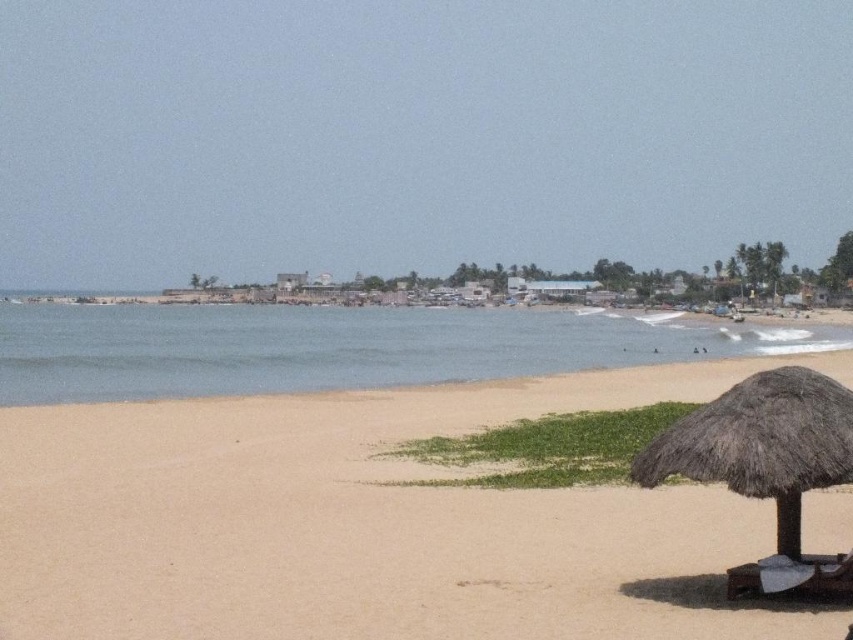
Based on the photo, between light brown sand at lower left and thatched straw umbrella at lower right, which one has less height?

light brown sand at lower left

Between light brown sand at lower left and thatched straw umbrella at lower right, which one is positioned lower?

Positioned lower is light brown sand at lower left.

Between point (90, 564) and point (645, 468), which one is positioned in front?

Point (645, 468) is in front.

Find the location of a particular element. light brown sand at lower left is located at coordinates (363, 522).

Is blue water at center smaller than thatched straw umbrella at lower right?

No.

Who is more forward, (291, 308) or (813, 426)?

Point (813, 426) is more forward.

Is point (360, 333) positioned after point (755, 477)?

That is True.

Where is `blue water at center`? blue water at center is located at coordinates (341, 346).

Between light brown sand at lower left and blue water at center, which one appears on the right side from the viewer's perspective?

Positioned to the right is light brown sand at lower left.

This screenshot has height=640, width=853. What do you see at coordinates (363, 522) in the screenshot?
I see `light brown sand at lower left` at bounding box center [363, 522].

Between point (96, 508) and point (177, 316), which one is positioned in front?

Point (96, 508)

Find the location of a particular element. The height and width of the screenshot is (640, 853). light brown sand at lower left is located at coordinates (363, 522).